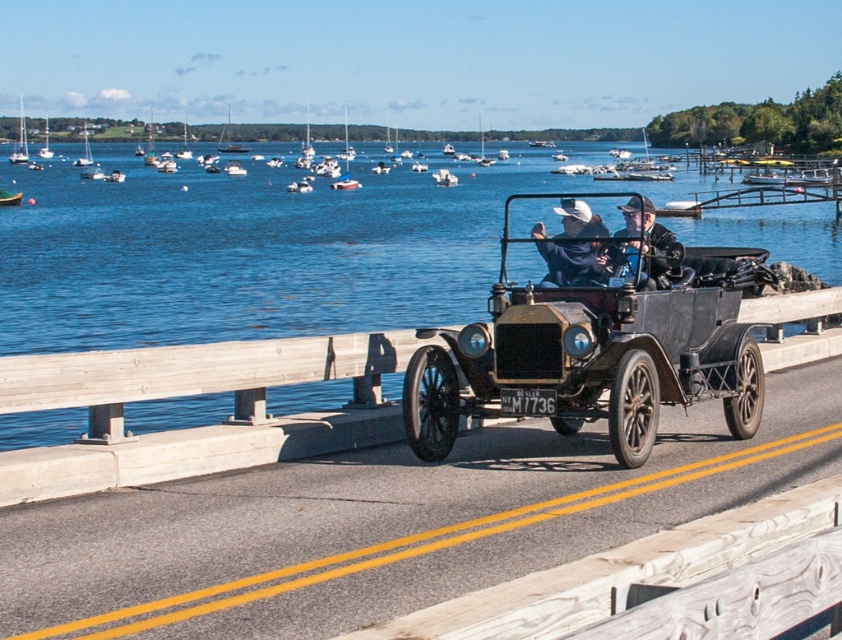
From the picture: Does blue water at center appear on the left side of white sailboat at center?

Incorrect, blue water at center is not on the left side of white sailboat at center.

Between blue water at center and white sailboat at center, which one is positioned higher?

white sailboat at center is above.

Who is more forward, (126, 209) or (242, 150)?

Point (126, 209) is in front.

Image resolution: width=842 pixels, height=640 pixels. Identify the location of blue water at center. (252, 250).

Can you confirm if blue water at center is wider than green fabric boat at left?

Yes.

Is blue water at center to the left of green fabric boat at left from the viewer's perspective?

In fact, blue water at center is to the right of green fabric boat at left.

The width and height of the screenshot is (842, 640). In order to click on blue water at center in this screenshot , I will do `click(252, 250)`.

Where is `blue water at center`? The image size is (842, 640). blue water at center is located at coordinates (252, 250).

Describe the element at coordinates (252, 250) in the screenshot. The width and height of the screenshot is (842, 640). I see `blue water at center` at that location.

Does blue water at center have a greater height compared to dark blue leather jacket at center?

Indeed, blue water at center has a greater height compared to dark blue leather jacket at center.

What are the coordinates of `blue water at center` in the screenshot? It's located at (252, 250).